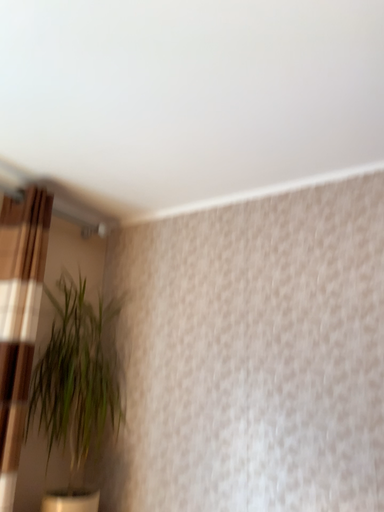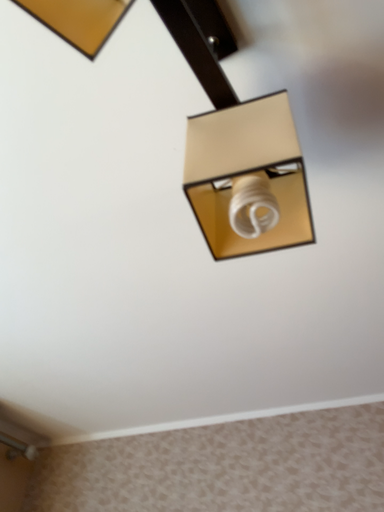
Question: Which way did the camera rotate in the video?

Choices:
 (A) rotated right
 (B) rotated left

Answer: (A)